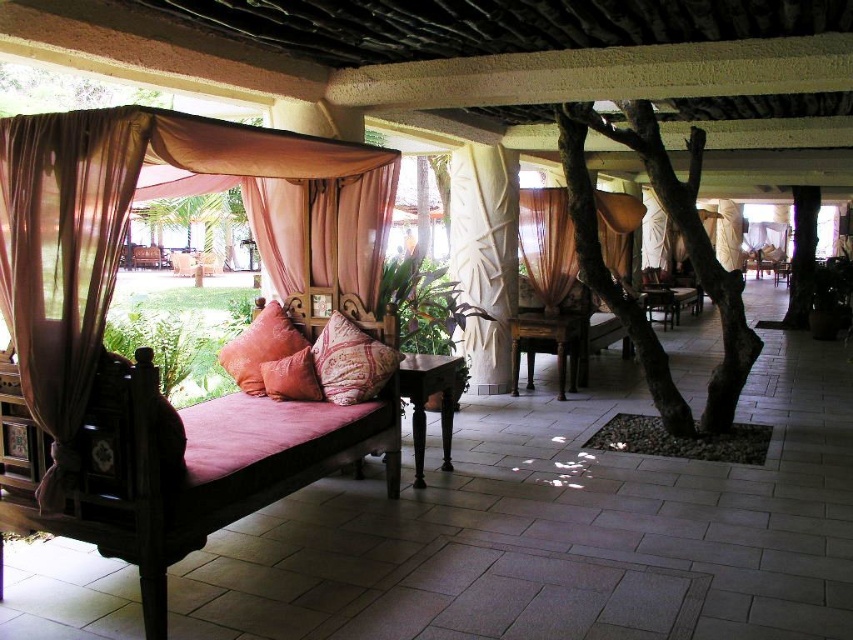
Question: Does sheer beige curtain at center appear over rustic fabric pillow at center?

Choices:
 (A) yes
 (B) no

Answer: (A)

Question: Does brown rough bark tree at center appear on the right side of textured orange pillow at center?

Choices:
 (A) no
 (B) yes

Answer: (B)

Question: Among these objects, which one is farthest from the camera?

Choices:
 (A) rustic fabric pillow at center
 (B) wooden bed frame at left
 (C) patterned fabric pillow at center

Answer: (A)

Question: Which point is closer to the camera?

Choices:
 (A) (611, 241)
 (B) (264, 378)
 (C) (219, 465)
 (D) (53, 227)

Answer: (D)

Question: Where is sheer beige curtain at center located in relation to textured orange pillow at center in the image?

Choices:
 (A) right
 (B) left

Answer: (A)

Question: Which point appears farthest from the camera in this image?

Choices:
 (A) tap(7, 154)
 (B) tap(345, 342)
 (C) tap(276, 237)

Answer: (C)